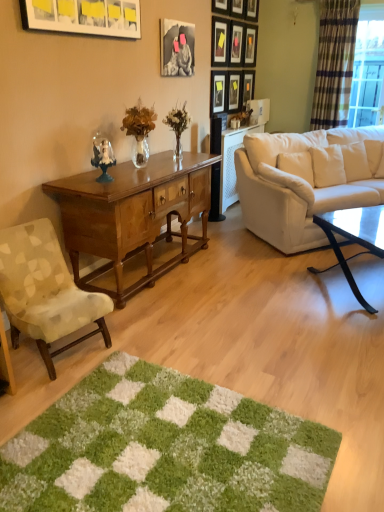
Question: From the image's perspective, relative to green shaggy rug at lower center, is wooden picture frame at upper center, arranged as the 7th picture frame when viewed from the right, above or below?

Choices:
 (A) below
 (B) above

Answer: (B)

Question: In terms of height, does wooden picture frame at upper center, acting as the fifth picture frame starting from the left, look taller or shorter compared to green shaggy rug at lower center?

Choices:
 (A) short
 (B) tall

Answer: (B)

Question: Estimate the real-world distances between objects in this image. Which object is closer to the matte white picture frame at upper left, the 1th picture frame from the left?

Choices:
 (A) green shaggy rug at lower center
 (B) white fabric couch at right
 (C) wooden picture frame at upper center, the sixth picture frame positioned from the right
 (D) wooden picture frame at upper center, placed as the seventh picture frame when sorted from left to right
 (E) matte black picture frame at upper center, arranged as the 4th picture frame when viewed from the right

Answer: (B)

Question: Which object is the farthest from the green shaggy rug at lower center?

Choices:
 (A) matte black picture frame at upper center, which appears as the 10th picture frame when viewed from the right
 (B) matte black picture frame at upper center, which ranks as the 1th picture frame in right-to-left order
 (C) matte black picture frame at upper center, which is the 9th picture frame from right to left
 (D) wooden picture frame at upper center, acting as the fifth picture frame starting from the left
 (E) light brown wood desk at center

Answer: (B)